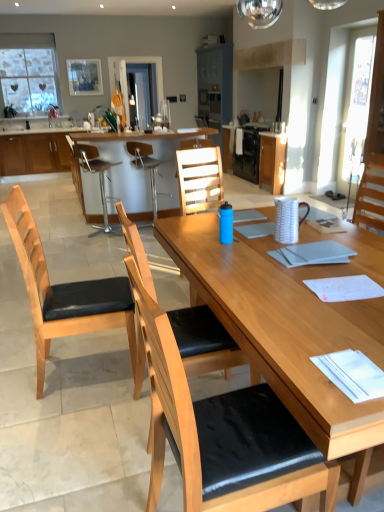
Question: Which direction should I rotate to look at wooden chair with black cushion at center, which is counted as the 2th chair, starting from the front, — up or down?

Choices:
 (A) down
 (B) up

Answer: (A)

Question: Is white glossy sink at upper center facing towards matte wood cabinet at center, the second cabinetry viewed from the left?

Choices:
 (A) yes
 (B) no

Answer: (B)

Question: Is white glossy sink at upper center in front of matte wood cabinet at center, arranged as the second cabinetry when viewed from the right?

Choices:
 (A) yes
 (B) no

Answer: (B)

Question: Is white glossy sink at upper center at the left side of matte wood cabinet at center, arranged as the second cabinetry when viewed from the right?

Choices:
 (A) no
 (B) yes

Answer: (B)

Question: Would you say white glossy sink at upper center is outside matte wood cabinet at center, arranged as the second cabinetry when viewed from the right?

Choices:
 (A) no
 (B) yes

Answer: (B)

Question: Is the depth of white glossy sink at upper center greater than that of matte wood cabinet at center, arranged as the second cabinetry when viewed from the right?

Choices:
 (A) no
 (B) yes

Answer: (B)

Question: Does white glossy sink at upper center have a lesser height compared to matte wood cabinet at center, the second cabinetry viewed from the left?

Choices:
 (A) no
 (B) yes

Answer: (B)

Question: Does wooden cabinet at left, placed as the 1th cabinetry when sorted from left to right, have a smaller size compared to wooden chair with black cushion at center, the first chair in the front-to-back sequence?

Choices:
 (A) no
 (B) yes

Answer: (A)

Question: Is the position of wooden cabinet at left, which is the 3th cabinetry from right to left, more distant than that of wooden chair with black cushion at center, which is the fifth chair in back-to-front order?

Choices:
 (A) yes
 (B) no

Answer: (A)

Question: Is wooden cabinet at left, placed as the 1th cabinetry when sorted from left to right, bigger than wooden chair with black cushion at center, which is the fifth chair in back-to-front order?

Choices:
 (A) no
 (B) yes

Answer: (B)

Question: Is wooden cabinet at left, placed as the 1th cabinetry when sorted from left to right, at the right side of wooden chair with black cushion at center, which is the fifth chair in back-to-front order?

Choices:
 (A) yes
 (B) no

Answer: (B)

Question: Is wooden cabinet at left, which is the 3th cabinetry from right to left, shorter than wooden chair with black cushion at center, the first chair in the front-to-back sequence?

Choices:
 (A) yes
 (B) no

Answer: (A)

Question: Considering the relative positions of wooden cabinet at left, placed as the 1th cabinetry when sorted from left to right, and wooden chair with black cushion at center, the first chair in the front-to-back sequence, in the image provided, is wooden cabinet at left, placed as the 1th cabinetry when sorted from left to right, to the left of wooden chair with black cushion at center, the first chair in the front-to-back sequence, from the viewer's perspective?

Choices:
 (A) no
 (B) yes

Answer: (B)

Question: Is light brown wood chair at center, the 1th chair when ordered from back to front, aimed at glass heart-patterned window at upper left?

Choices:
 (A) yes
 (B) no

Answer: (B)